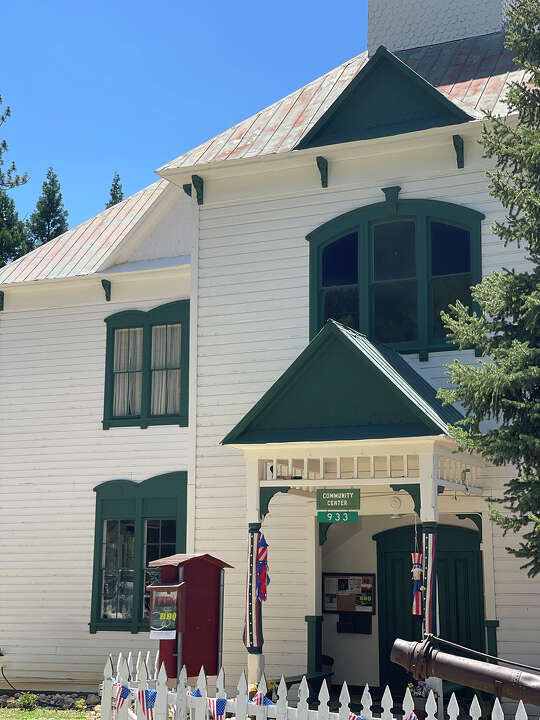
Where is `green window trim`? green window trim is located at coordinates (421, 212).